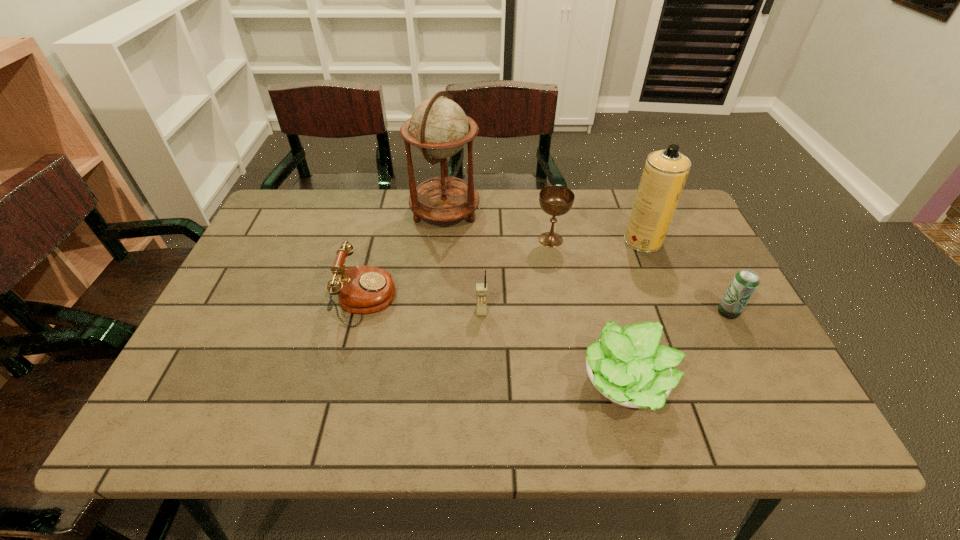
Find the location of `the tallest object`. the tallest object is located at coordinates (439, 128).

This screenshot has height=540, width=960. What are the coordinates of `the second object from right to left` in the screenshot? It's located at (665, 172).

The image size is (960, 540). Find the location of `the second tallest object`. the second tallest object is located at coordinates (665, 172).

Find the location of a particular element. This screenshot has height=540, width=960. chalice is located at coordinates (555, 200).

Where is `cellular telephone`? The width and height of the screenshot is (960, 540). cellular telephone is located at coordinates (481, 288).

Locate an element on the screen. Image resolution: width=960 pixels, height=540 pixels. telephone is located at coordinates (361, 289).

Where is `beer can`? beer can is located at coordinates (745, 282).

This screenshot has height=540, width=960. I want to click on the nearest object, so click(x=627, y=366).

Find the location of a particular element. the shortest object is located at coordinates (627, 366).

The width and height of the screenshot is (960, 540). I want to click on free location located 0.050m on the surface of the tallest object, so click(x=495, y=212).